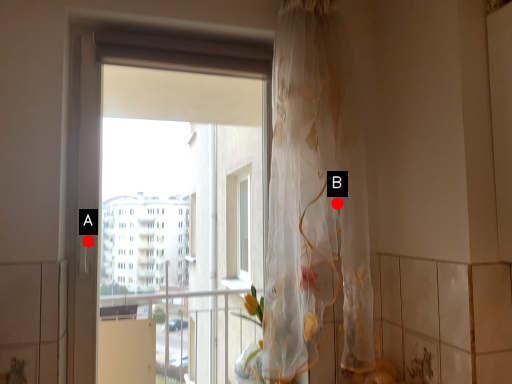
Question: Two points are circled on the image, labeled by A and B beside each circle. Which point is farther from the camera taking this photo?

Choices:
 (A) A is further
 (B) B is further

Answer: (A)